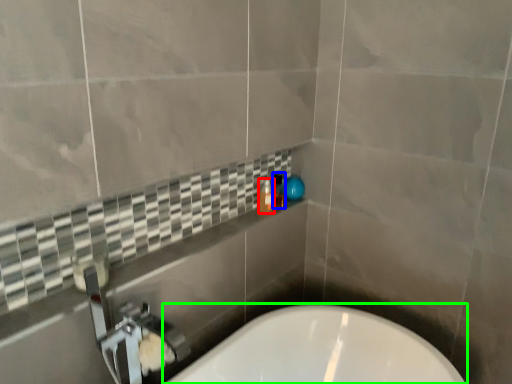
Question: Which is farther away from bottle (highlighted by a red box)? toiletry (highlighted by a blue box) or bathtub (highlighted by a green box)?

Choices:
 (A) toiletry
 (B) bathtub

Answer: (B)